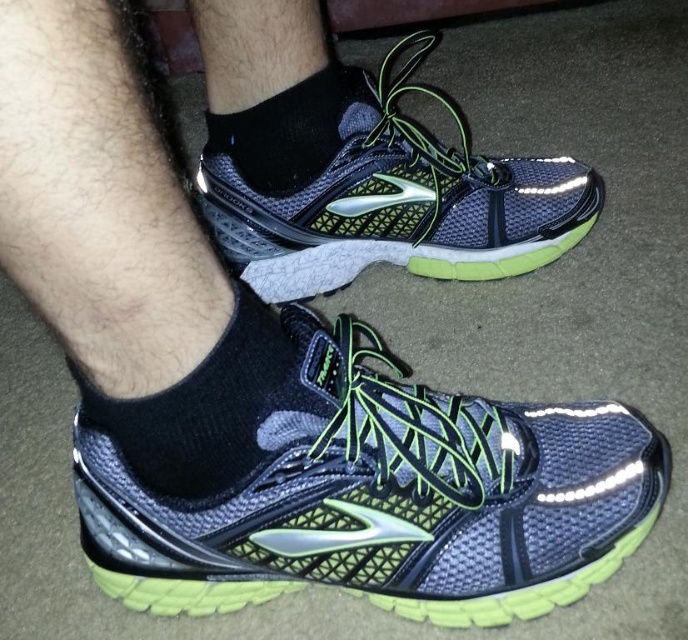
Is the position of matte mesh shoe at center more distant than that of matte mesh running shoe at center?

No, it is not.

Which is behind, point (266, 451) or point (462, 145)?

The point (462, 145) is behind.

Is point (451, 520) farther from viewer compared to point (241, 208)?

No, it is in front of (241, 208).

Where is `matte mesh shoe at center`? matte mesh shoe at center is located at coordinates (383, 497).

Which is below, matte mesh running shoe at center or black mesh sock at center?

black mesh sock at center is lower down.

Does point (347, 205) come behind point (308, 168)?

Yes.

Between point (226, 198) and point (330, 90), which one is positioned behind?

The point (226, 198) is more distant.

The image size is (688, 640). I want to click on matte mesh running shoe at center, so click(x=394, y=196).

Does point (294, 518) lie behind point (266, 307)?

No, (294, 518) is closer to viewer.

Where is `matte mesh shoe at center`? Image resolution: width=688 pixels, height=640 pixels. matte mesh shoe at center is located at coordinates (383, 497).

The width and height of the screenshot is (688, 640). What are the coordinates of `matte mesh shoe at center` in the screenshot? It's located at (383, 497).